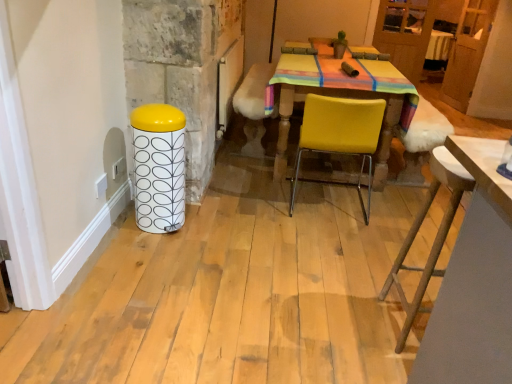
Question: From a real-world perspective, is white glossy trash can at left physically above yellow matte chair at center?

Choices:
 (A) yes
 (B) no

Answer: (B)

Question: From the image's perspective, is white glossy trash can at left located above yellow matte chair at center?

Choices:
 (A) no
 (B) yes

Answer: (A)

Question: Can you confirm if white glossy trash can at left is shorter than yellow matte chair at center?

Choices:
 (A) no
 (B) yes

Answer: (B)

Question: Is white glossy trash can at left far from yellow matte chair at center?

Choices:
 (A) no
 (B) yes

Answer: (A)

Question: Does white glossy trash can at left contain yellow matte chair at center?

Choices:
 (A) yes
 (B) no

Answer: (B)

Question: Does white glossy trash can at left have a larger size compared to yellow matte chair at center?

Choices:
 (A) no
 (B) yes

Answer: (A)

Question: Can wooden table at lower right be found inside white glossy trash can at left?

Choices:
 (A) yes
 (B) no

Answer: (B)

Question: Considering the relative positions of white glossy trash can at left and wooden table at lower right in the image provided, is white glossy trash can at left behind wooden table at lower right?

Choices:
 (A) yes
 (B) no

Answer: (A)

Question: Is white glossy trash can at left aimed at wooden table at lower right?

Choices:
 (A) yes
 (B) no

Answer: (B)

Question: Is white glossy trash can at left closer to the viewer compared to wooden table at lower right?

Choices:
 (A) no
 (B) yes

Answer: (A)

Question: Would you consider white glossy trash can at left to be distant from wooden table at lower right?

Choices:
 (A) no
 (B) yes

Answer: (B)

Question: Considering the relative sizes of white glossy trash can at left and wooden table at lower right in the image provided, is white glossy trash can at left smaller than wooden table at lower right?

Choices:
 (A) yes
 (B) no

Answer: (A)

Question: From a real-world perspective, is velvet yellow armchair at center physically below yellow matte chair at center?

Choices:
 (A) yes
 (B) no

Answer: (B)